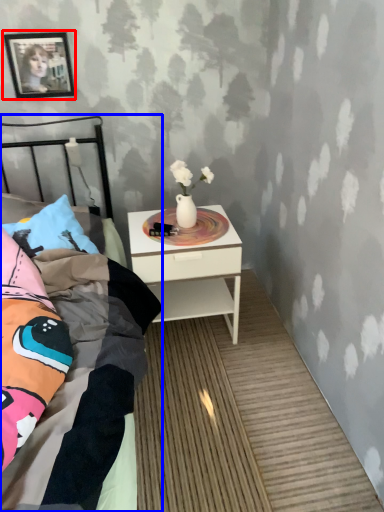
Question: Which object appears closest to the camera in this image, picture frame (highlighted by a red box) or bed (highlighted by a blue box)?

Choices:
 (A) picture frame
 (B) bed

Answer: (B)